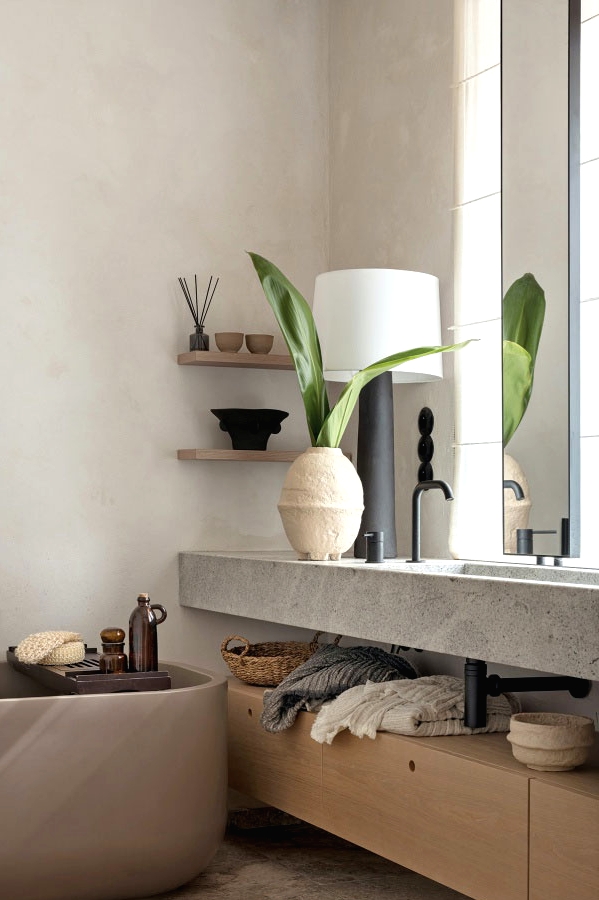
Image resolution: width=599 pixels, height=900 pixels. In order to click on reed diffusers in this screenshot , I will do `click(193, 307)`.